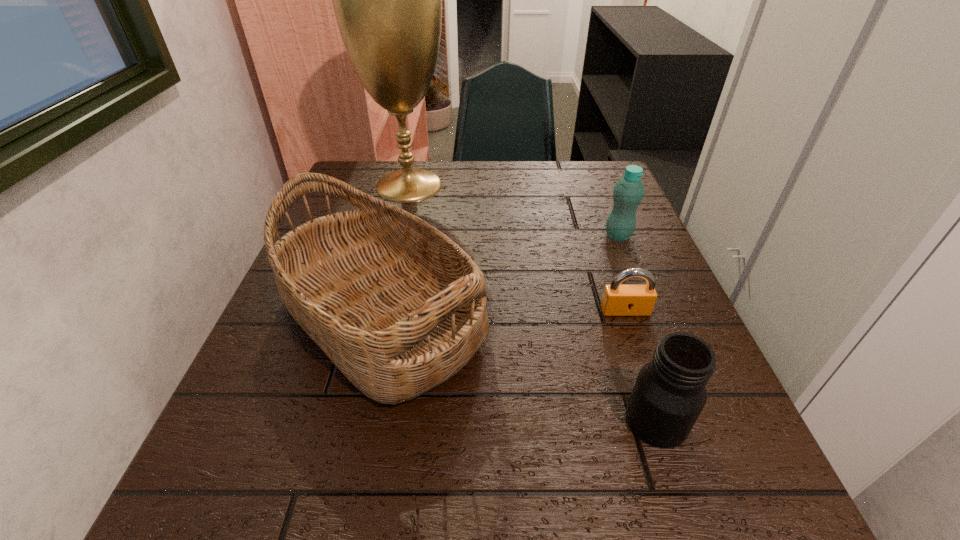
Locate an element on the screen. The image size is (960, 540). trophy cup is located at coordinates (387, 0).

You are a GUI agent. You are given a task and a screenshot of the screen. Output one action in this format:
    pyautogui.click(x=<x>, y=<y>)
    Task: Click on the tallest object
    Image resolution: width=960 pixels, height=540 pixels.
    Given the screenshot: What is the action you would take?
    pyautogui.click(x=387, y=0)

This screenshot has height=540, width=960. What are the coordinates of `basket` in the screenshot? It's located at (399, 308).

Where is `water bottle`? water bottle is located at coordinates (628, 192).

Where is `jar`? Image resolution: width=960 pixels, height=540 pixels. jar is located at coordinates (669, 394).

Locate an element on the screen. Image resolution: width=960 pixels, height=540 pixels. padlock is located at coordinates (618, 300).

You are a GUI agent. You are given a task and a screenshot of the screen. Output one action in this format:
    pyautogui.click(x=<x>, y=<y>)
    Task: Click on the vacant space situated on the front of the farthest object
    This screenshot has width=960, height=540.
    Given the screenshot: What is the action you would take?
    pyautogui.click(x=392, y=256)

You are a GUI agent. You are given a task and a screenshot of the screen. Output one action in this format:
    pyautogui.click(x=<x>, y=<y>)
    Task: Click on the vacant space located 0.200m on the back of the basket
    This screenshot has height=540, width=960.
    Given the screenshot: What is the action you would take?
    pyautogui.click(x=408, y=205)

Locate an element on the screen. Image resolution: width=960 pixels, height=540 pixels. free space located at the front cap of the water bottle is located at coordinates (671, 367).

Locate an element on the screen. free space located on the back of the jar is located at coordinates (616, 300).